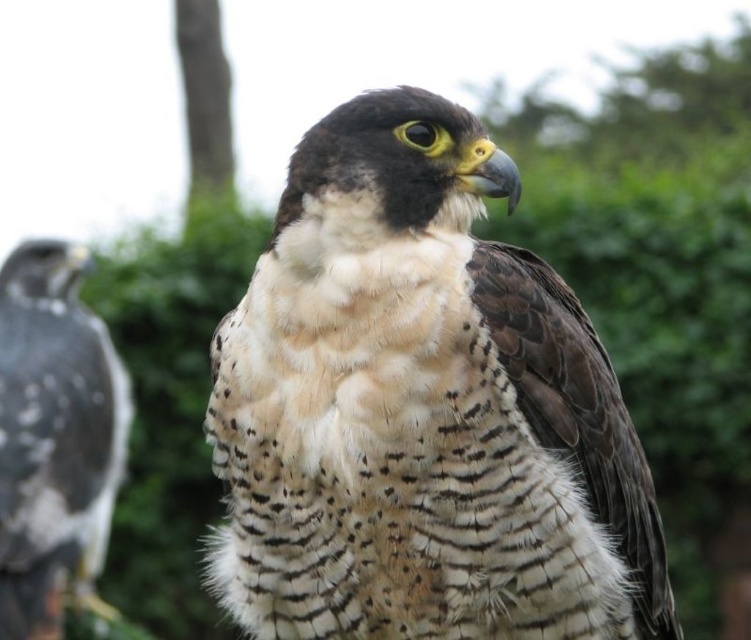
Question: Considering the real-world distances, which object is farthest from the speckled brown falcon at left?

Choices:
 (A) green textured tree at upper left
 (B) speckled feathered falcon at center

Answer: (B)

Question: Can you confirm if speckled feathered falcon at center is positioned to the left of speckled brown falcon at left?

Choices:
 (A) yes
 (B) no

Answer: (B)

Question: Does speckled feathered falcon at center appear on the right side of green textured tree at upper left?

Choices:
 (A) no
 (B) yes

Answer: (B)

Question: Does speckled feathered falcon at center appear on the right side of green textured tree at upper left?

Choices:
 (A) yes
 (B) no

Answer: (A)

Question: Considering the real-world distances, which object is closest to the speckled feathered falcon at center?

Choices:
 (A) green textured tree at upper left
 (B) speckled brown falcon at left

Answer: (B)

Question: Which object appears farthest from the camera in this image?

Choices:
 (A) green textured tree at upper left
 (B) speckled brown falcon at left

Answer: (A)